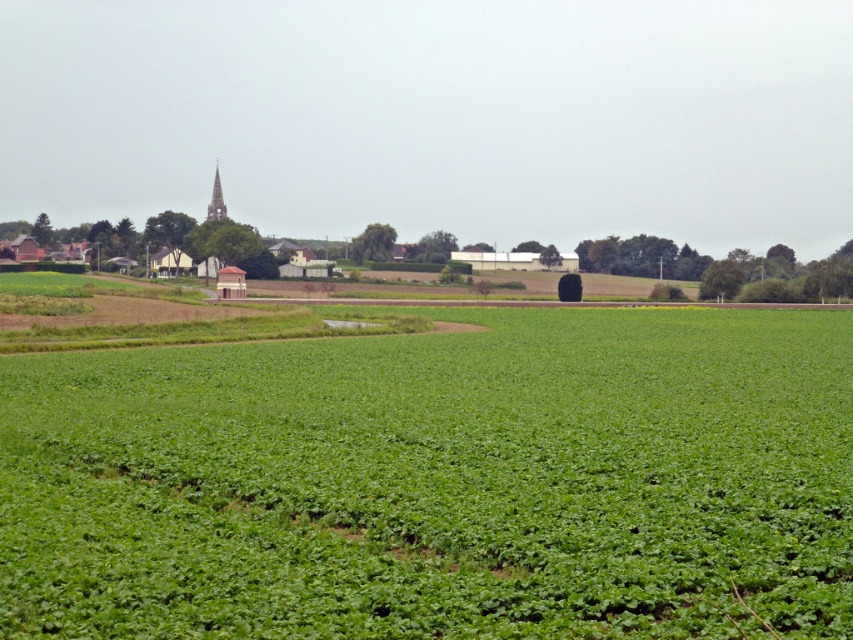
You are a drone operator flying over the rural landscape. You need to determine if the green leafy field at center is visible above the smooth gray spire at upper left. Based on their heights, what is your conclusion?

The green leafy field at center is shorter than the smooth gray spire at upper left, so it will not be visible above the smooth gray spire at upper left.

You are a farmer planning to plant a new crop in the green leafy field at center and the smooth gray spire at upper left. Which field is located to the right of the other?

The green leafy field at center is positioned on the right side of the smooth gray spire at upper left.